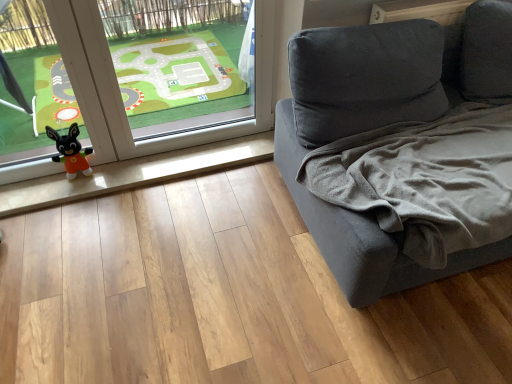
Identify the location of transparent plastic window screen at lower left. (180, 63).

This screenshot has width=512, height=384. What do you see at coordinates (180, 63) in the screenshot? I see `transparent plastic window screen at lower left` at bounding box center [180, 63].

Consider the image. In order to face transparent plastic window screen at lower left, should I rotate leftwards or rightwards?

Turn left approximately 8.893 degrees to face it.

Image resolution: width=512 pixels, height=384 pixels. I want to click on transparent plastic window screen at lower left, so click(180, 63).